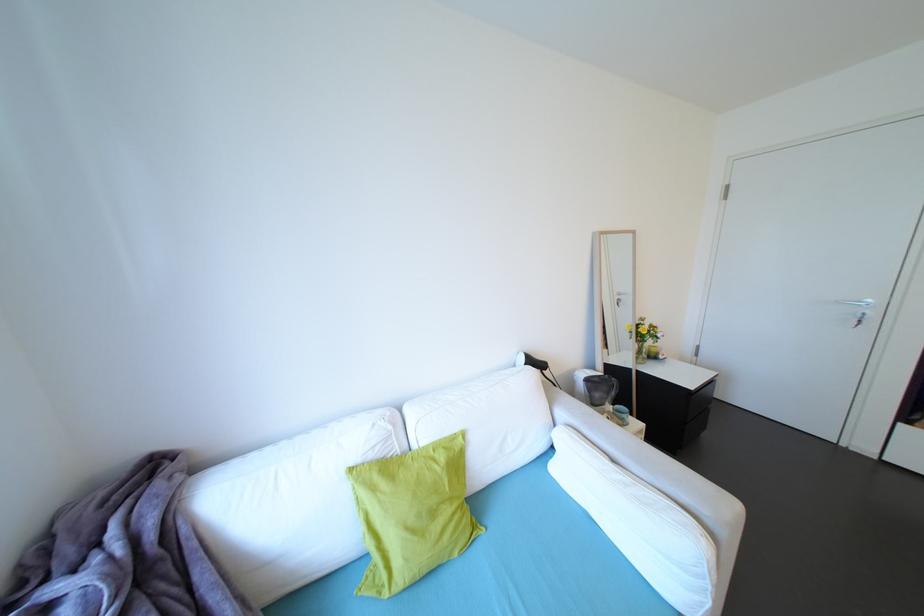
Locate an element on the screen. The width and height of the screenshot is (924, 616). sofa sitting surface is located at coordinates 495,572.